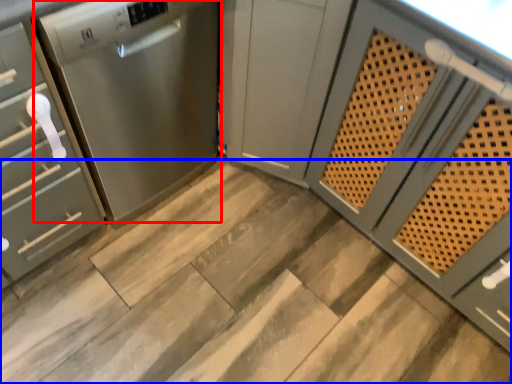
Question: Which object is further to the camera taking this photo, home appliance (highlighted by a red box) or stair (highlighted by a blue box)?

Choices:
 (A) home appliance
 (B) stair

Answer: (B)